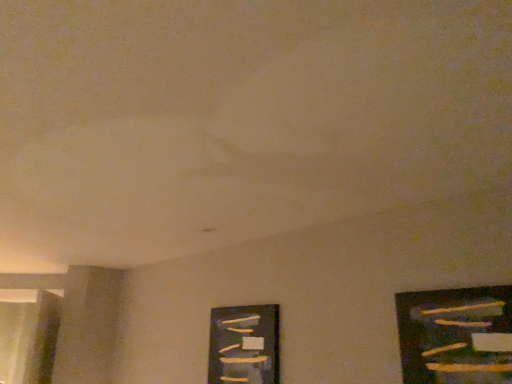
Question: Looking at their shapes, would you say wooden frame at lower center, placed as the 2th picture frame when sorted from right to left, is wider or thinner than wooden frame at right, which ranks as the second picture frame in left-to-right order?

Choices:
 (A) thin
 (B) wide

Answer: (B)

Question: From the image's perspective, is wooden frame at lower center, which is the first picture frame from left to right, positioned above or below wooden frame at right, the first picture frame positioned from the right?

Choices:
 (A) above
 (B) below

Answer: (B)

Question: Is wooden frame at lower center, positioned as the 2th picture frame in front-to-back order, to the left or to the right of wooden frame at right, which ranks as the second picture frame in left-to-right order, in the image?

Choices:
 (A) left
 (B) right

Answer: (A)

Question: Do you think wooden frame at right, the first picture frame positioned from the right, is within wooden frame at lower center, positioned as the 2th picture frame in front-to-back order, or outside of it?

Choices:
 (A) outside
 (B) inside

Answer: (A)

Question: Visually, is wooden frame at right, positioned as the first picture frame in front-to-back order, positioned to the left or to the right of wooden frame at lower center, which is the first picture frame from left to right?

Choices:
 (A) right
 (B) left

Answer: (A)

Question: Considering the positions of wooden frame at right, positioned as the first picture frame in front-to-back order, and wooden frame at lower center, placed as the 2th picture frame when sorted from right to left, in the image, is wooden frame at right, positioned as the first picture frame in front-to-back order, taller or shorter than wooden frame at lower center, placed as the 2th picture frame when sorted from right to left,?

Choices:
 (A) tall
 (B) short

Answer: (B)

Question: Looking at their shapes, would you say wooden frame at right, positioned as the first picture frame in front-to-back order, is wider or thinner than wooden frame at lower center, the first picture frame from the back?

Choices:
 (A) wide
 (B) thin

Answer: (B)